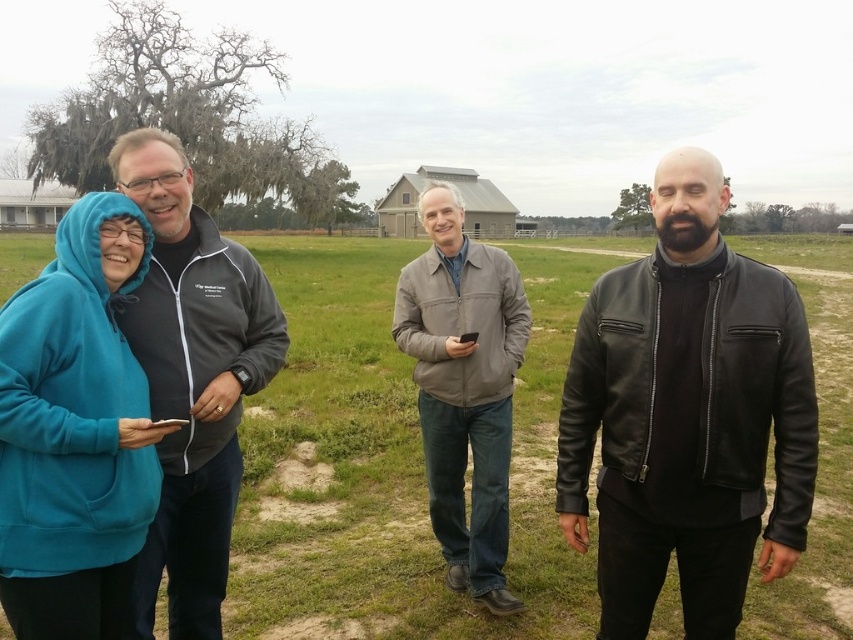
Question: Among these points, which one is farthest from the camera?

Choices:
 (A) (386, 401)
 (B) (467, 344)
 (C) (775, 538)
 (D) (199, 592)

Answer: (A)

Question: Which of the following is the closest to the observer?

Choices:
 (A) (271, 605)
 (B) (444, 385)

Answer: (B)

Question: Which point is farther to the camera?

Choices:
 (A) (666, 284)
 (B) (312, 376)
 (C) (462, 524)
 (D) (96, 218)

Answer: (B)

Question: Is black leather jacket at right closer to camera compared to gray leather jacket at center?

Choices:
 (A) no
 (B) yes

Answer: (B)

Question: Can you confirm if teal fleece at left is thinner than gray leather jacket at center?

Choices:
 (A) no
 (B) yes

Answer: (A)

Question: Is teal fleece at left behind dark gray zip-up jacket at left?

Choices:
 (A) no
 (B) yes

Answer: (B)